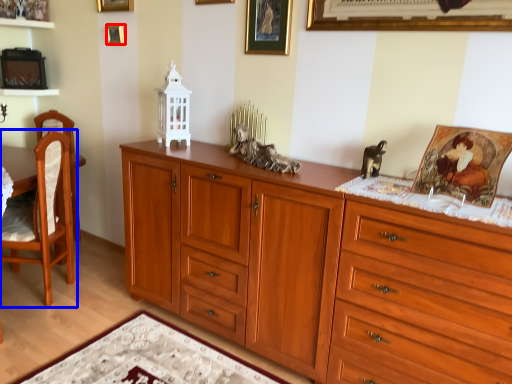
Question: Which object appears closest to the camera in this image, picture frame (highlighted by a red box) or chair (highlighted by a blue box)?

Choices:
 (A) picture frame
 (B) chair

Answer: (B)